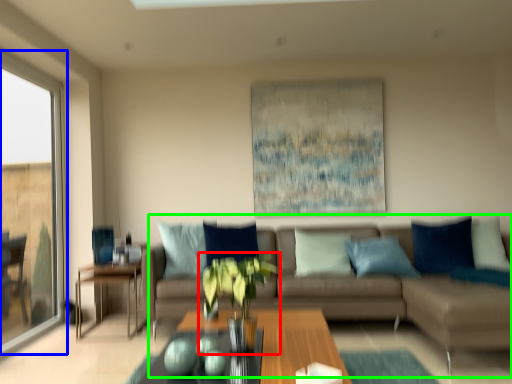
Question: Which object is positioned farthest from houseplant (highlighted by a red box)? Select from window (highlighted by a blue box) and studio couch (highlighted by a green box).

Choices:
 (A) window
 (B) studio couch

Answer: (A)